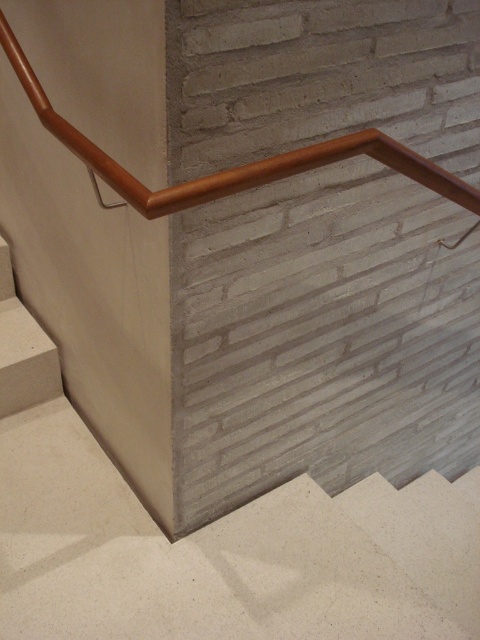
Looking at this image, can you confirm if wooden handrail at upper center is taller than white concrete stair at lower left?

In fact, wooden handrail at upper center may be shorter than white concrete stair at lower left.

Which is below, wooden handrail at upper center or white concrete stair at lower left?

white concrete stair at lower left is lower down.

Between point (109, 180) and point (49, 358), which one is positioned in front?

Point (109, 180)

At what (x,y) coordinates should I click in order to perform the action: click on wooden handrail at upper center. Please return your answer as a coordinate pair (x, y). This screenshot has width=480, height=640. Looking at the image, I should click on (230, 168).